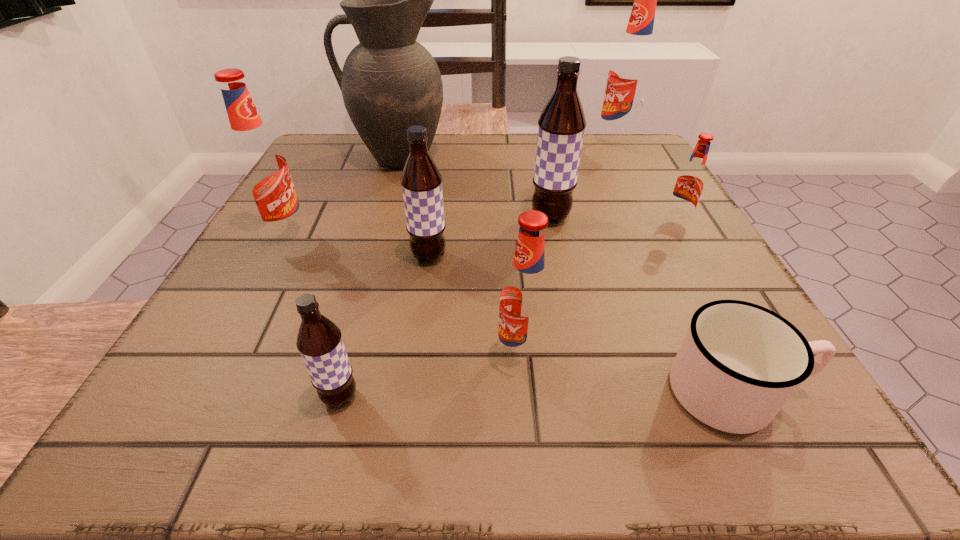
I want to click on vacant space at the near right corner of the desktop, so click(x=785, y=424).

You are a GUI agent. You are given a task and a screenshot of the screen. Output one action in this format:
    pyautogui.click(x=<x>, y=<y>)
    Task: Click on the blank region between the second red root beer from left to right and the shortest object
    
    Given the screenshot: What is the action you would take?
    [x=628, y=374]

The image size is (960, 540). I want to click on free space between the mug and the farthest red root beer, so click(x=675, y=268).

Find the location of a particular element. free space that is in between the leftmost red root beer and the second smallest brown root beer is located at coordinates (357, 246).

Image resolution: width=960 pixels, height=540 pixels. I want to click on empty location between the pitcher and the biggest red root beer, so click(x=507, y=151).

Where is `free area in between the pitcher and the mug`? free area in between the pitcher and the mug is located at coordinates (566, 275).

Locate an element on the screen. This screenshot has height=540, width=960. free space that is in between the second smallest red root beer and the leftmost root beer is located at coordinates (403, 296).

I want to click on empty location between the biggest red root beer and the nearest red root beer, so click(x=568, y=251).

Locate an element on the screen. free space between the fifth root beer from left to right and the pitcher is located at coordinates (474, 188).

This screenshot has height=540, width=960. I want to click on object that is the eighth closest to the shortest object, so click(260, 165).